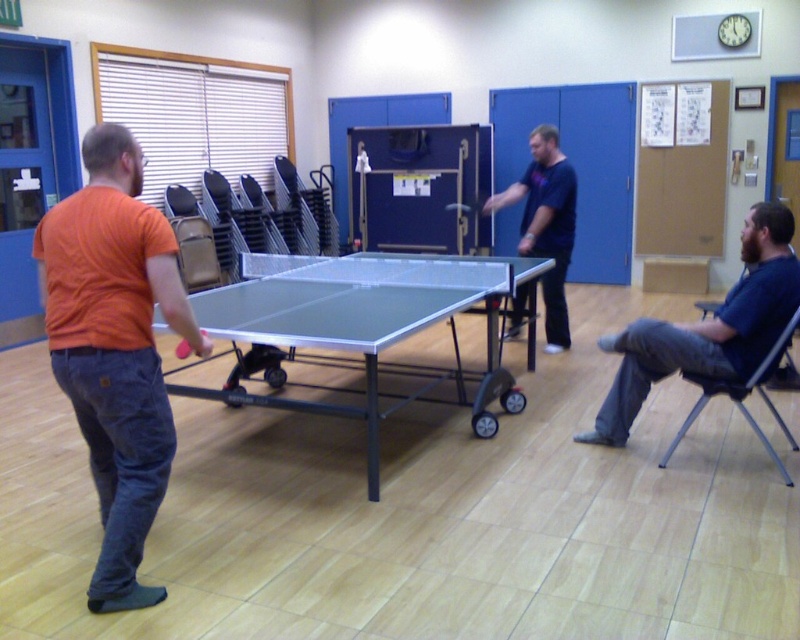
Question: Which object is positioned farthest from the orange cotton t-shirt at left?

Choices:
 (A) blue cotton shirt at right
 (B) dark blue shirt at center
 (C) silver metallic ping pong table at center

Answer: (B)

Question: Is silver metallic ping pong table at center below metallic gray chair at lower right?

Choices:
 (A) no
 (B) yes

Answer: (A)

Question: Which point is closer to the camera?

Choices:
 (A) (778, 321)
 (B) (180, 355)
 (C) (541, 200)
 (D) (137, 333)

Answer: (D)

Question: Can you confirm if orange cotton t-shirt at left is thinner than rubber grip paddle at left?

Choices:
 (A) no
 (B) yes

Answer: (A)

Question: Which object is farther from the camera taking this photo?

Choices:
 (A) rubber grip paddle at left
 (B) metallic gray chair at lower right

Answer: (B)

Question: Does orange cotton t-shirt at left appear on the left side of rubber grip paddle at left?

Choices:
 (A) no
 (B) yes

Answer: (B)